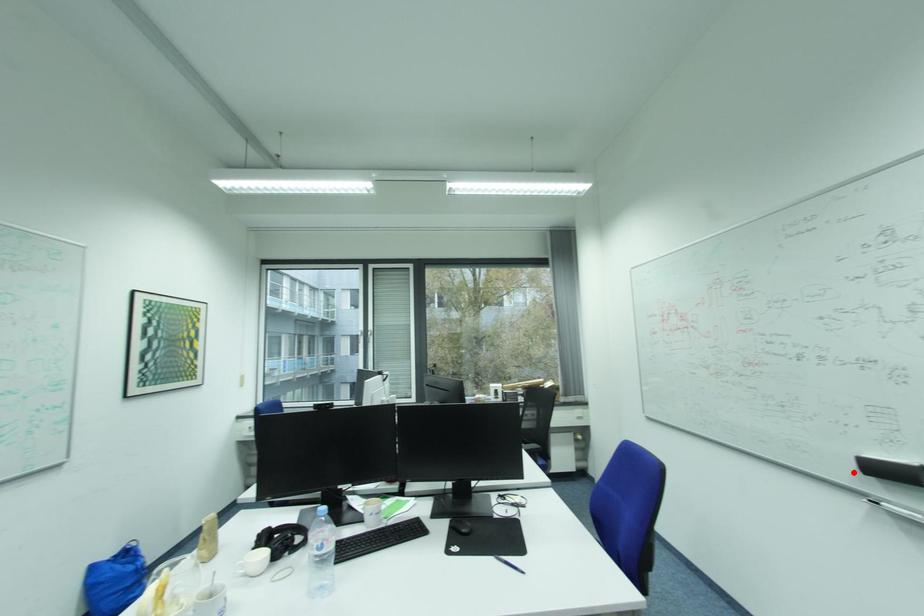
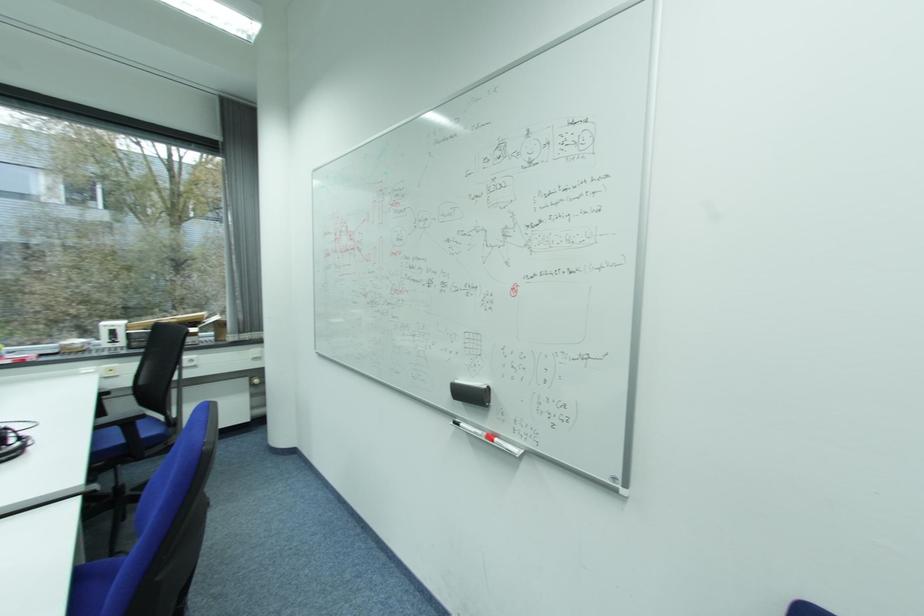
Question: I am providing you with two images of the same scene from different viewpoints. A red point is marked on the first image. Is the red point's position out of view in image 2?

Choices:
 (A) Yes
 (B) No

Answer: (B)